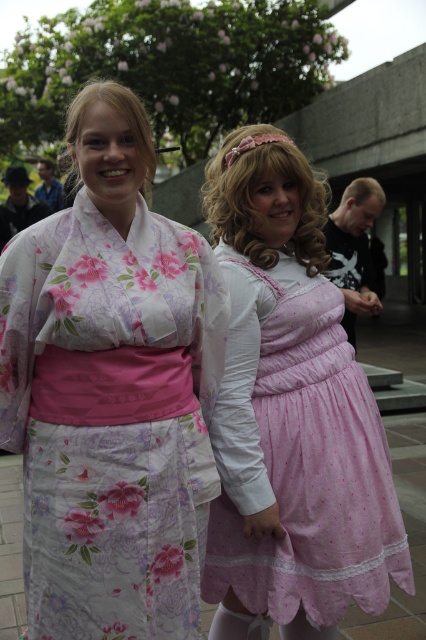
Question: Which object appears closest to the camera in this image?

Choices:
 (A) pink satin dress at center
 (B) floral silk kimono at center

Answer: (B)

Question: Does floral silk kimono at center appear on the left side of pink satin dress at center?

Choices:
 (A) yes
 (B) no

Answer: (A)

Question: Based on their relative distances, which object is nearer to the floral silk kimono at center?

Choices:
 (A) pink satin dress at center
 (B) matte black shirt at right

Answer: (A)

Question: Which object is the farthest from the pink satin dress at center?

Choices:
 (A) matte black shirt at right
 (B) floral silk kimono at center

Answer: (A)

Question: From the image, what is the correct spatial relationship of pink satin dress at center in relation to matte black shirt at right?

Choices:
 (A) above
 (B) below

Answer: (B)

Question: Is floral silk kimono at center wider than matte black shirt at right?

Choices:
 (A) no
 (B) yes

Answer: (B)